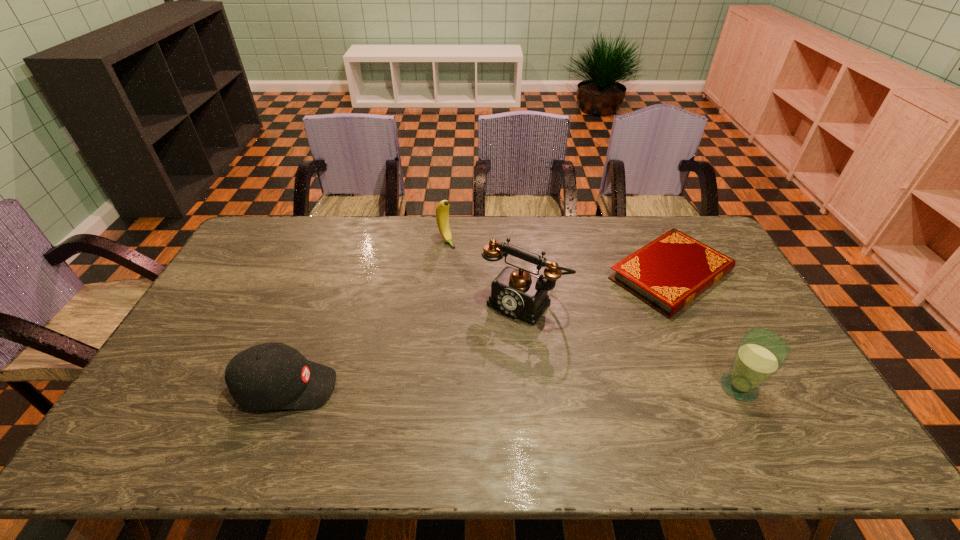
At what (x,y) coordinates should I click in order to perform the action: click on object that is the second closest to the second object from left to right. Please return your answer as a coordinate pair (x, y). Looking at the image, I should click on (668, 273).

Where is `free space that satisfies the following two spatial constraints: 1. on the front side of the glass; 2. on the left side of the tallest object`? The width and height of the screenshot is (960, 540). free space that satisfies the following two spatial constraints: 1. on the front side of the glass; 2. on the left side of the tallest object is located at coordinates (533, 387).

Where is `free space in the image that satisfies the following two spatial constraints: 1. on the front side of the fourth object from right to left; 2. on the left side of the glass`? The image size is (960, 540). free space in the image that satisfies the following two spatial constraints: 1. on the front side of the fourth object from right to left; 2. on the left side of the glass is located at coordinates (433, 387).

Locate an element on the screen. vacant space that satisfies the following two spatial constraints: 1. on the front side of the banana; 2. on the left side of the glass is located at coordinates (433, 387).

Where is `vacant region that satisfies the following two spatial constraints: 1. on the front side of the shortest object; 2. on the left side of the banana`? The height and width of the screenshot is (540, 960). vacant region that satisfies the following two spatial constraints: 1. on the front side of the shortest object; 2. on the left side of the banana is located at coordinates point(444,275).